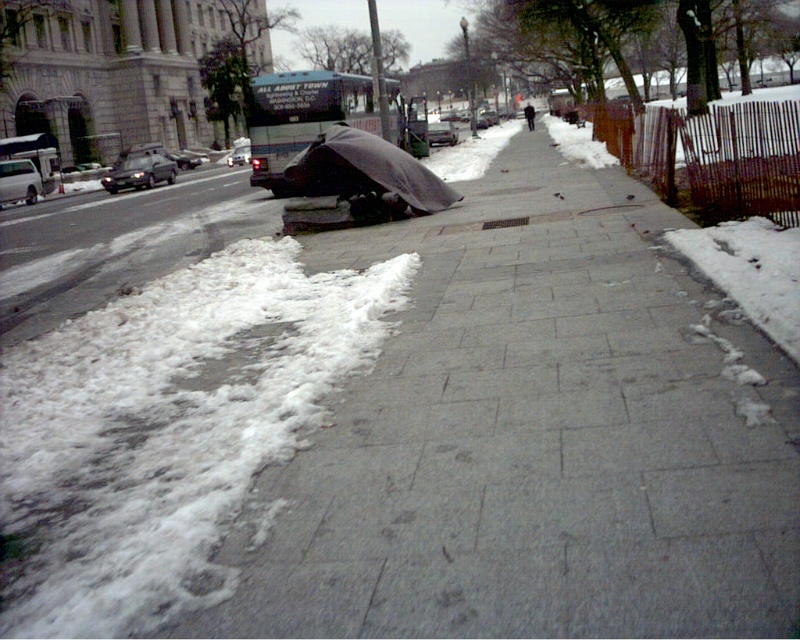
You are a delivery person trying to deliver a package to the gray concrete sidewalk at center. The shiny black sedan at left is blocking the path. Can you go around the sedan to reach the sidewalk?

The gray concrete sidewalk at center is much taller than the shiny black sedan at left, so you can easily go around the sedan to reach the sidewalk.

You are standing at the origin point of the image coordinate system. Where is the dark gray tarp at center located in terms of its 2D coordinates?

The dark gray tarp at center is located at the 2D coordinates of point (366, 172).